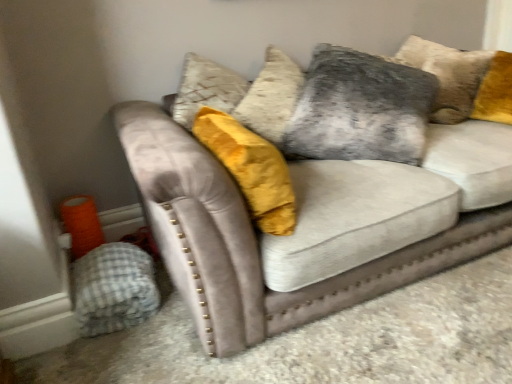
Where is `free space above gray checkered blanket at lower left (from a real-world perspective)`? This screenshot has height=384, width=512. free space above gray checkered blanket at lower left (from a real-world perspective) is located at coordinates (105, 266).